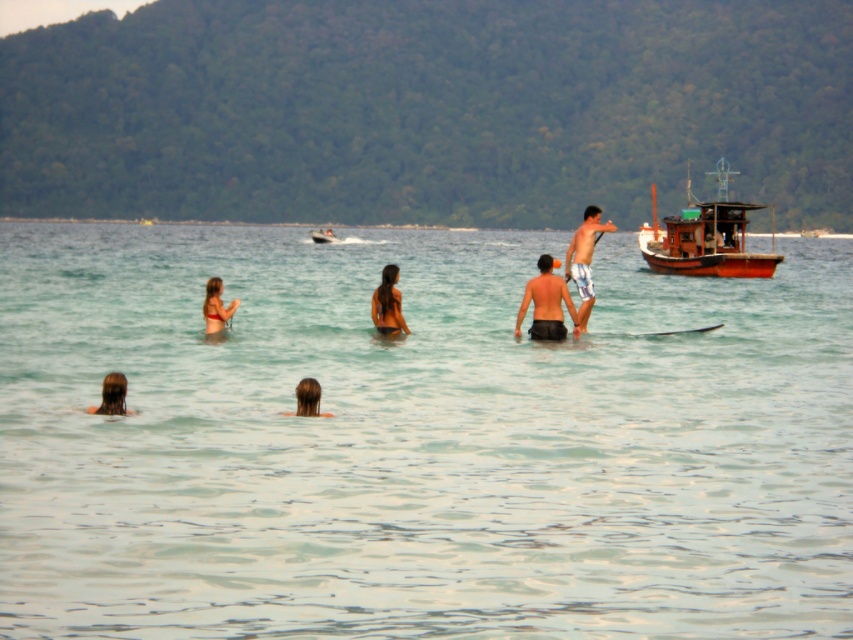
You are standing on the beach and want to reach the light blue striped shorts at center from your current position. The motorboat is 100 feet long. Can you use the motorboat to reach the shorts?

The light blue striped shorts at center are 84.36 feet away from you. Since the motorboat is 100 feet long, it can easily accommodate the distance required to reach them.

From the picture: You are a photographer trying to capture the light blue striped shorts at center in the beach scene. Based on the coordinates provided, where should you position your camera to ensure the shorts are centered in your shot?

The light blue striped shorts at center are located at the 2D coordinates point [584,260], so positioning the camera to center the shot at those coordinates will ensure the shorts are centered in the image.

You are a swimmer who wants to reach the wooden boat at right from the clear water at center. Which direction should you swim to get there?

You should swim to the right because the clear water at center is to the left of wooden boat at right, so moving right will lead you towards the wooden boat at right.